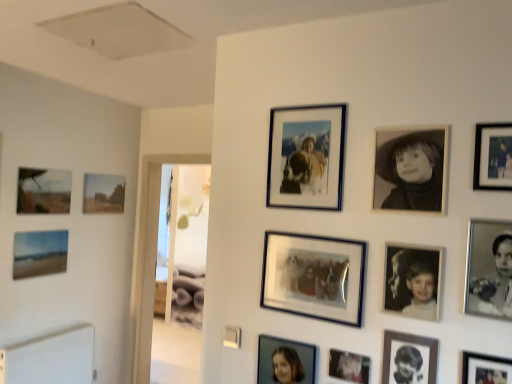
Question: From the image's perspective, is metallic silver photo frame at lower center, which is the 7th picture frame in back-to-front order, located above matte blue painting at lower left, which appears as the thirteenth picture frame when viewed from the right?

Choices:
 (A) yes
 (B) no

Answer: (B)

Question: Are metallic silver photo frame at lower center, the seventh picture frame from the right, and matte blue painting at lower left, the 2th picture frame viewed from the back, far apart?

Choices:
 (A) no
 (B) yes

Answer: (B)

Question: From a real-world perspective, does metallic silver photo frame at lower center, which is the 7th picture frame in back-to-front order, stand above matte blue painting at lower left, the twelfth picture frame when ordered from front to back?

Choices:
 (A) no
 (B) yes

Answer: (A)

Question: Is metallic silver photo frame at lower center, positioned as the seventh picture frame in left-to-right order, closer to the viewer compared to matte blue painting at lower left, the 2th picture frame viewed from the back?

Choices:
 (A) yes
 (B) no

Answer: (A)

Question: Considering the relative sizes of metallic silver photo frame at lower center, placed as the 7th picture frame when sorted from front to back, and matte blue painting at lower left, the 2th picture frame viewed from the back, in the image provided, is metallic silver photo frame at lower center, placed as the 7th picture frame when sorted from front to back, wider than matte blue painting at lower left, the 2th picture frame viewed from the back,?

Choices:
 (A) yes
 (B) no

Answer: (B)

Question: Based on their positions, is matte canvas painting at left, marked as the 2th picture frame in a left-to-right arrangement, located to the left or right of matte black picture frame at upper right, placed as the 1th picture frame when sorted from right to left?

Choices:
 (A) left
 (B) right

Answer: (A)

Question: Which is correct: matte canvas painting at left, placed as the 12th picture frame when sorted from right to left, is inside matte black picture frame at upper right, which is counted as the thirteenth picture frame, starting from the left, or outside of it?

Choices:
 (A) inside
 (B) outside

Answer: (B)

Question: Considering the positions of matte canvas painting at left, placed as the third picture frame when sorted from back to front, and matte black picture frame at upper right, placed as the eleventh picture frame when sorted from back to front, in the image, is matte canvas painting at left, placed as the third picture frame when sorted from back to front, wider or thinner than matte black picture frame at upper right, placed as the eleventh picture frame when sorted from back to front,?

Choices:
 (A) wide
 (B) thin

Answer: (B)

Question: Is matte canvas painting at left, positioned as the 11th picture frame in front-to-back order, in front of or behind matte black picture frame at upper right, placed as the eleventh picture frame when sorted from back to front, in the image?

Choices:
 (A) behind
 (B) front

Answer: (A)

Question: Considering the positions of black glossy photo frame at lower right, which is the eighth picture frame from left to right, and black matte portrait at upper right, which is the 8th picture frame from back to front, in the image, is black glossy photo frame at lower right, which is the eighth picture frame from left to right, wider or thinner than black matte portrait at upper right, which is the 8th picture frame from back to front,?

Choices:
 (A) wide
 (B) thin

Answer: (B)

Question: From a real-world perspective, is black glossy photo frame at lower right, the fourth picture frame in the front-to-back sequence, physically located above or below black matte portrait at upper right, the fifth picture frame in the right-to-left sequence?

Choices:
 (A) below
 (B) above

Answer: (A)

Question: From the image's perspective, relative to black matte portrait at upper right, which is the 8th picture frame from back to front, is black glossy photo frame at lower right, the fourth picture frame in the front-to-back sequence, above or below?

Choices:
 (A) above
 (B) below

Answer: (B)

Question: Is point (424, 357) positioned closer to the camera than point (435, 145)?

Choices:
 (A) farther
 (B) closer

Answer: (B)

Question: Is matte brown landscape at left, which is counted as the thirteenth picture frame, starting from the front, wider or thinner than matte silver photo frame at lower center, the 10th picture frame positioned from the right?

Choices:
 (A) thin
 (B) wide

Answer: (A)

Question: From the image's perspective, is matte brown landscape at left, the first picture frame when ordered from back to front, above or below matte silver photo frame at lower center, placed as the tenth picture frame when sorted from front to back?

Choices:
 (A) below
 (B) above

Answer: (B)